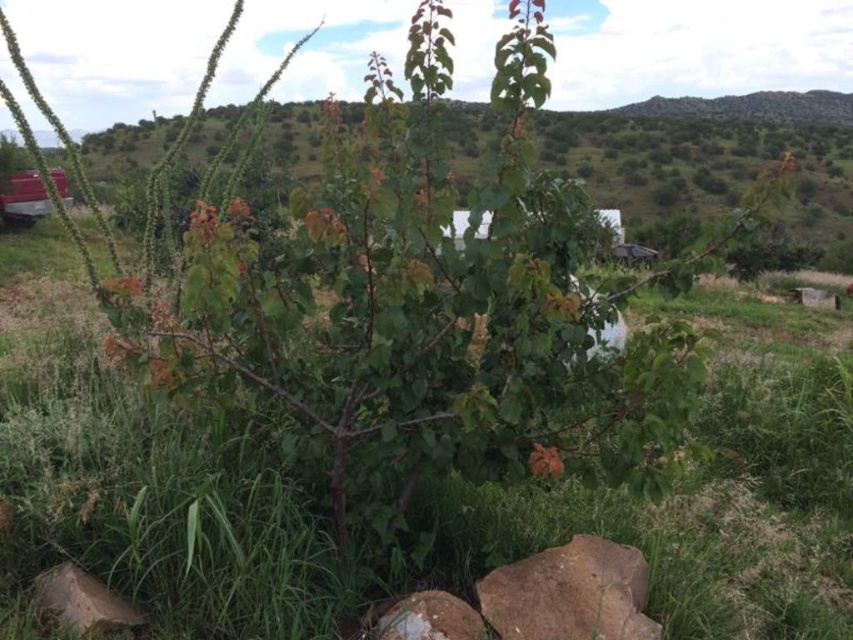
Which is below, brown rough rock at lower center or brown rough boulder at lower left?

brown rough rock at lower center is lower down.

Does brown rough rock at lower center have a smaller size compared to brown rough boulder at lower left?

No.

Does point (566, 609) come farther from viewer compared to point (38, 592)?

Yes.

What are the coordinates of `brown rough rock at lower center` in the screenshot? It's located at (570, 593).

Which is above, brown rough rock at lower center or rusty metallic boulder at lower center?

Positioned higher is brown rough rock at lower center.

Can you confirm if brown rough rock at lower center is positioned to the right of rusty metallic boulder at lower center?

Correct, you'll find brown rough rock at lower center to the right of rusty metallic boulder at lower center.

Identify the location of brown rough rock at lower center. (570, 593).

Based on the photo, which is above, rusty metallic boulder at lower center or metallic red car at left?

metallic red car at left is above.

Between rusty metallic boulder at lower center and metallic red car at left, which one has more height?

With more height is metallic red car at left.

The width and height of the screenshot is (853, 640). What do you see at coordinates (430, 618) in the screenshot?
I see `rusty metallic boulder at lower center` at bounding box center [430, 618].

Where is `rusty metallic boulder at lower center`? Image resolution: width=853 pixels, height=640 pixels. rusty metallic boulder at lower center is located at coordinates (430, 618).